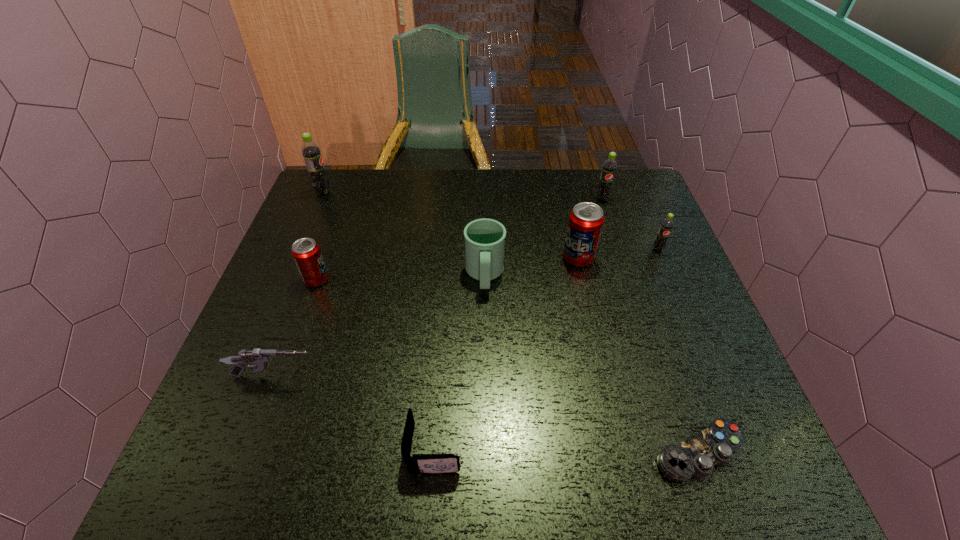
Identify the location of free region that satisfies the following two spatial constraints: 1. on the front label of the tallest soda can; 2. on the back side of the right red soda can. The width and height of the screenshot is (960, 540). (295, 258).